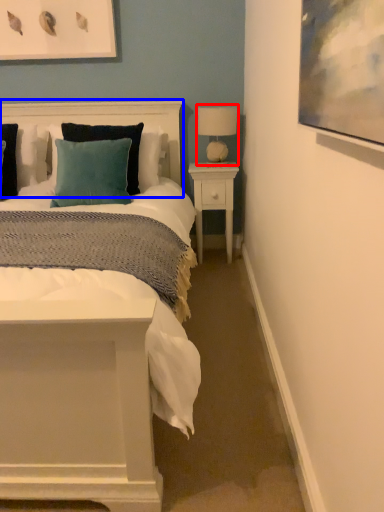
Question: Which of the following is the closest to the observer, table lamp (highlighted by a red box) or headboard (highlighted by a blue box)?

Choices:
 (A) table lamp
 (B) headboard

Answer: (B)